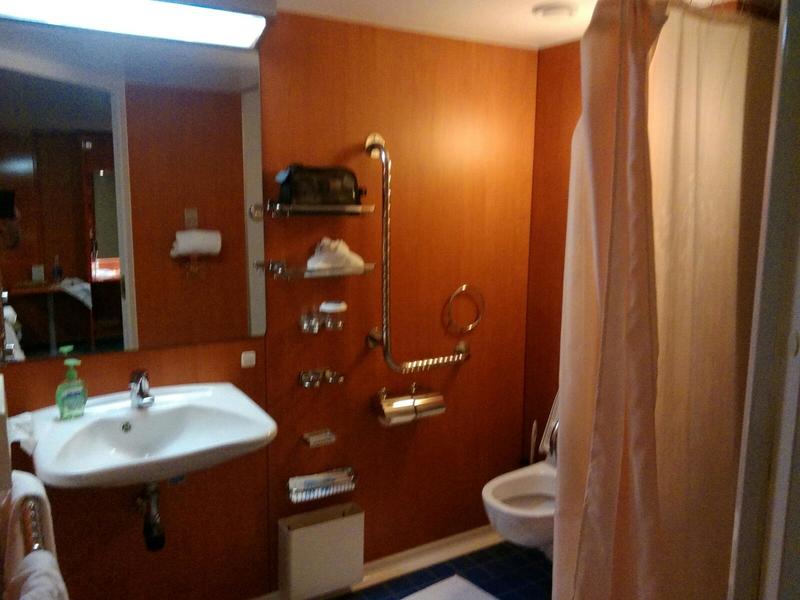
Image resolution: width=800 pixels, height=600 pixels. I want to click on bathroom mirror, so click(201, 108).